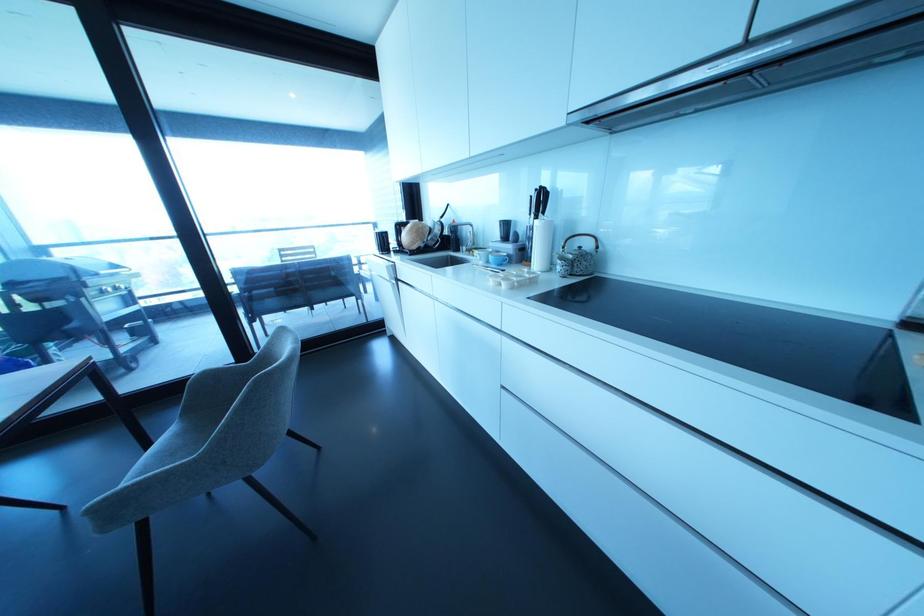
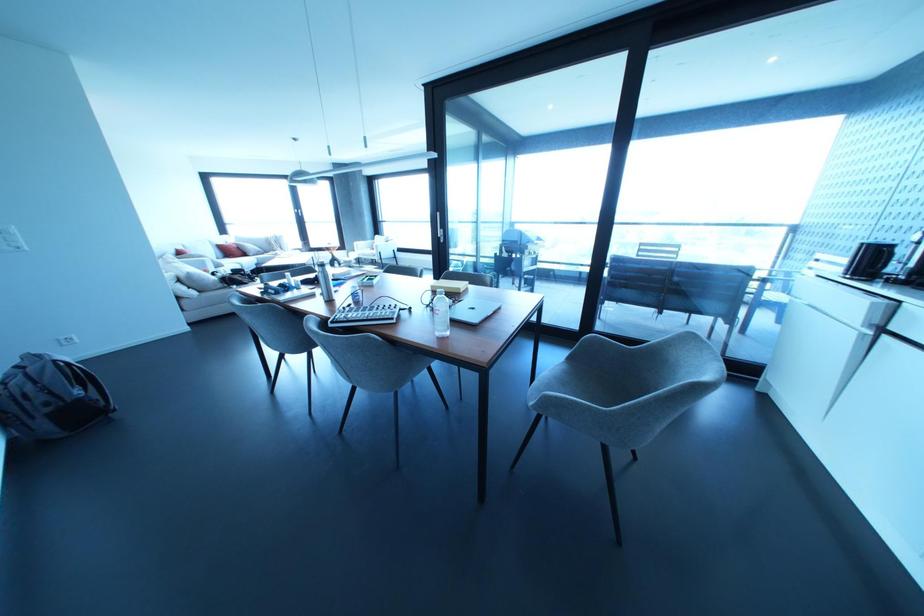
Find the pixel in the second image that matches point (126, 488) in the first image.

(566, 399)